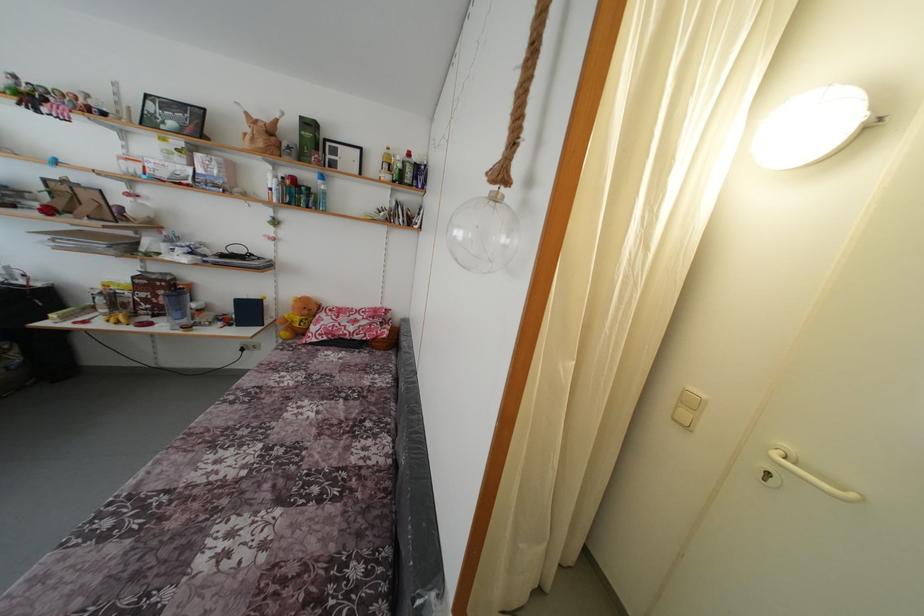
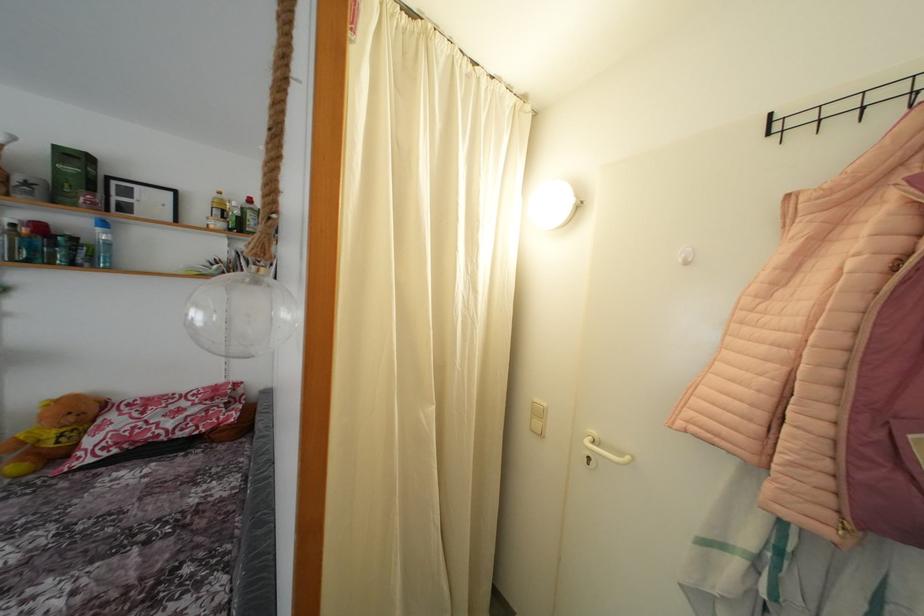
In the second image, find the point that corresponds to (773,480) in the first image.

(593, 464)